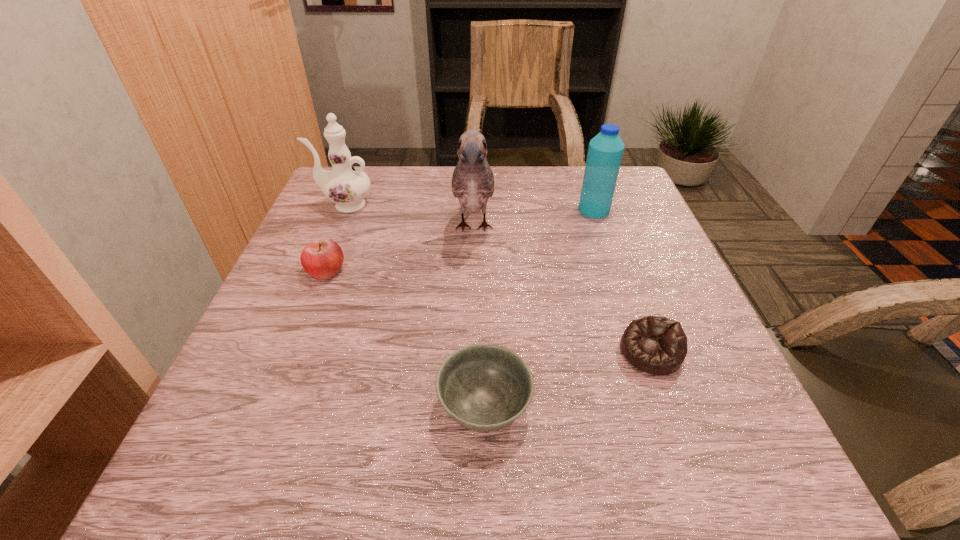
Identify the location of object at the far right corner. (605, 151).

In the image, there is a desktop. At what (x,y) coordinates should I click in order to perform the action: click on blank space at the far edge. Please return your answer as a coordinate pair (x, y). This screenshot has width=960, height=540. Looking at the image, I should click on (508, 200).

Image resolution: width=960 pixels, height=540 pixels. Find the location of `vacant space at the left edge of the desktop`. vacant space at the left edge of the desktop is located at coordinates (333, 336).

Find the location of a particular element. This screenshot has height=540, width=960. free space at the right edge of the desktop is located at coordinates (734, 416).

At what (x,y) coordinates should I click in order to perform the action: click on blank space at the far left corner of the desktop. Please return your answer as a coordinate pair (x, y). Looking at the image, I should click on (378, 180).

Find the location of a particular element. This screenshot has height=540, width=960. vacant region at the near left corner of the desktop is located at coordinates (251, 465).

Where is `free space at the far right corner`? free space at the far right corner is located at coordinates (624, 184).

The width and height of the screenshot is (960, 540). Find the location of `vacant position at the near right corner of the desktop`. vacant position at the near right corner of the desktop is located at coordinates (683, 481).

Where is `vacant region between the parrot and the apple`? Image resolution: width=960 pixels, height=540 pixels. vacant region between the parrot and the apple is located at coordinates (399, 249).

What are the coordinates of `blank region between the chinaware and the parrot` in the screenshot? It's located at (409, 217).